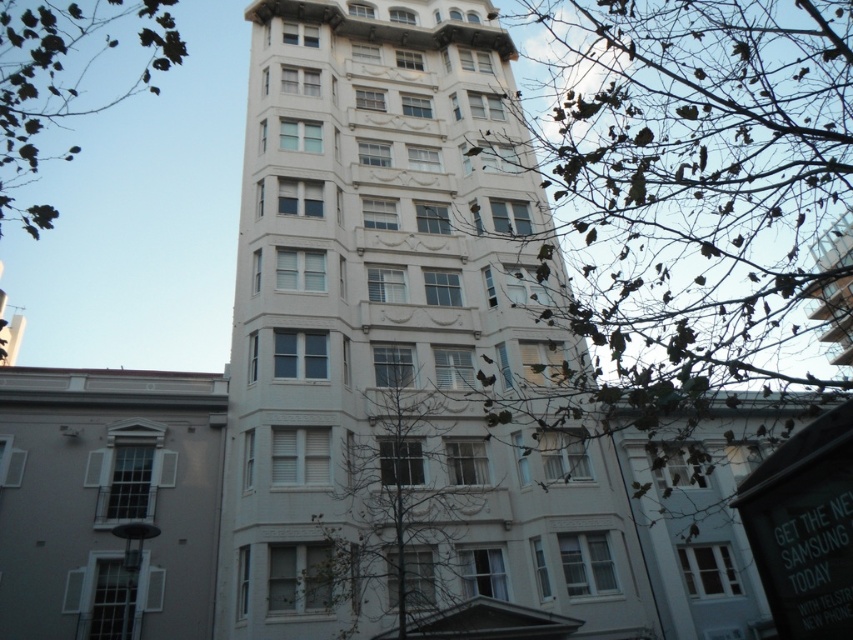
Question: Which object appears closest to the camera in this image?

Choices:
 (A) green leafy tree at upper right
 (B) green leafless tree at center
 (C) white smooth building at center
 (D) green leafy tree at upper left

Answer: (A)

Question: Does green leafy tree at upper right have a larger size compared to green leafy tree at upper left?

Choices:
 (A) yes
 (B) no

Answer: (B)

Question: Among these points, which one is farthest from the camera?

Choices:
 (A) (378, 381)
 (B) (22, 58)

Answer: (B)

Question: Which point is closer to the camera?

Choices:
 (A) (405, 422)
 (B) (480, 216)

Answer: (A)

Question: Is white smooth building at center to the left of green leafy tree at upper left from the viewer's perspective?

Choices:
 (A) yes
 (B) no

Answer: (B)

Question: Can you confirm if white smooth building at center is bigger than green leafy tree at upper left?

Choices:
 (A) no
 (B) yes

Answer: (A)